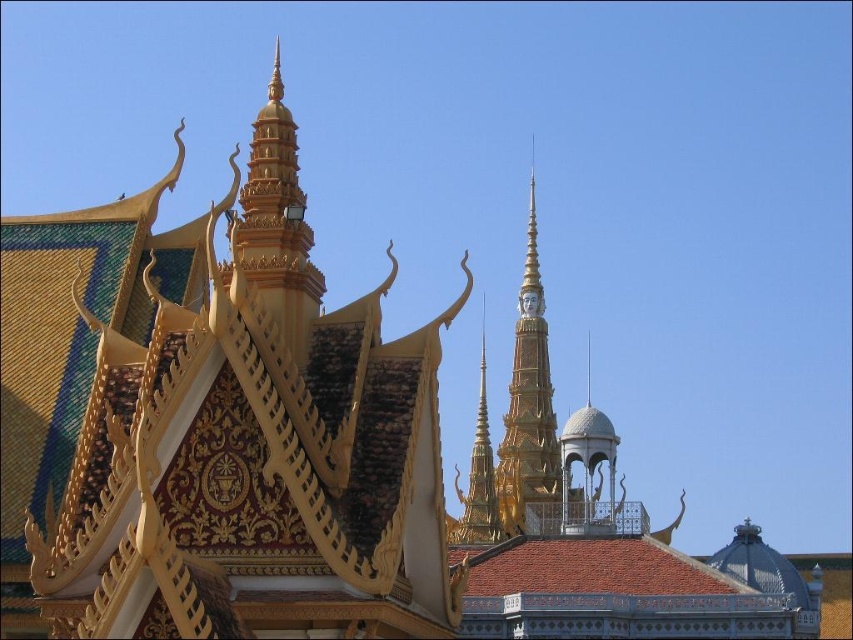
You are standing in front of the grand temple structure. There are two points marked on the image. The first point is at coordinates point (238,218) and the second point is at coordinates point (485,516). Which point is nearer to you?

Point (238,218) is closer to the camera than point (485,516), so the first point is nearer to you.